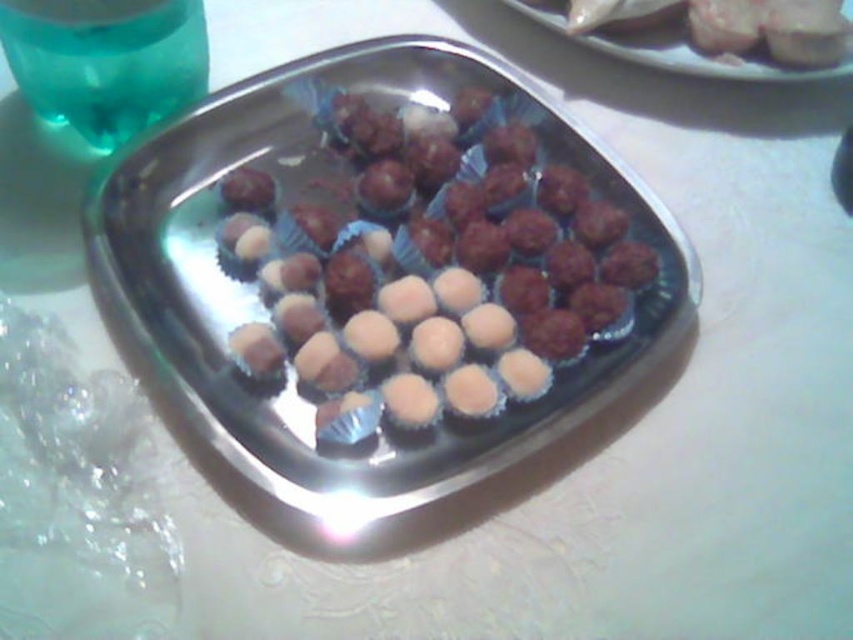
In the scene shown: You are setting up a buffet table and need to place both the shiny silver tray at center and the matte silver platter at upper right. Based on their sizes, which one should you place first to ensure they fit properly?

The shiny silver tray at center is wider than the matte silver platter at upper right, so you should place the shiny silver tray at center first to accommodate its larger size before positioning the smaller matte silver platter at upper right.